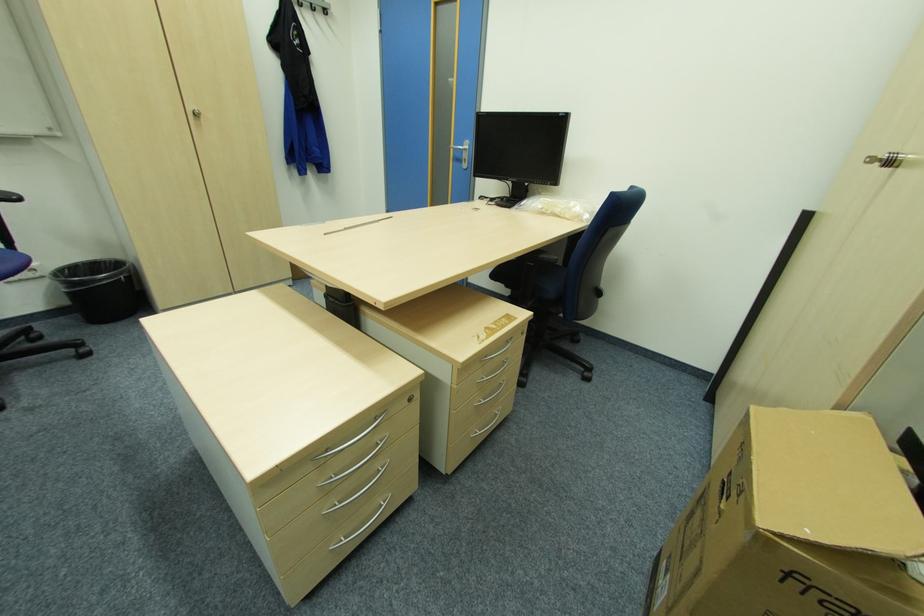
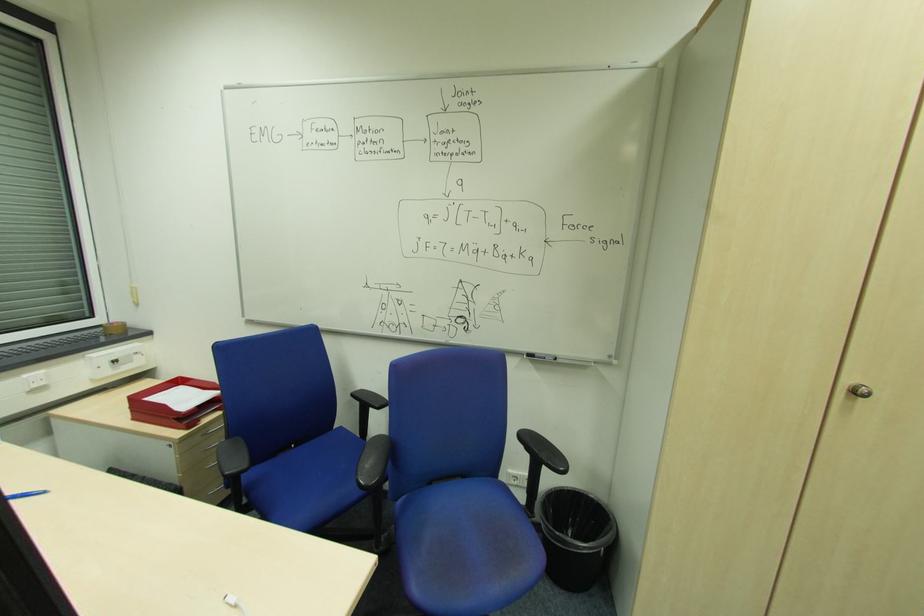
Where in the second image is the point corresponding to [113,261] from the first image?

(594, 499)